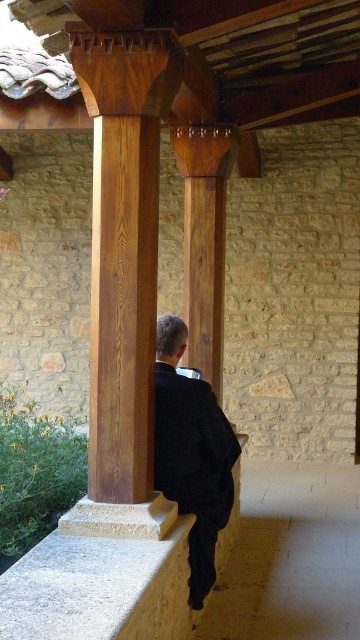
Question: Which object is farther from the camera taking this photo?

Choices:
 (A) smooth concrete ledge at lower center
 (B) polished wood pillar at center
 (C) smooth polished wood column at center

Answer: (B)

Question: Does smooth polished wood column at center appear on the right side of black matte suit at center?

Choices:
 (A) no
 (B) yes

Answer: (A)

Question: Estimate the real-world distances between objects in this image. Which object is farther from the black matte suit at center?

Choices:
 (A) polished wood pillar at center
 (B) smooth concrete ledge at lower center
 (C) smooth polished wood column at center

Answer: (A)

Question: Is smooth polished wood column at center thinner than polished wood pillar at center?

Choices:
 (A) yes
 (B) no

Answer: (B)

Question: Which point is closer to the camera taking this photo?

Choices:
 (A) (114, 477)
 (B) (218, 525)
 (C) (41, 621)
 (D) (216, 189)

Answer: (C)

Question: From the image, what is the correct spatial relationship of black matte suit at center in relation to polished wood pillar at center?

Choices:
 (A) above
 (B) below

Answer: (B)